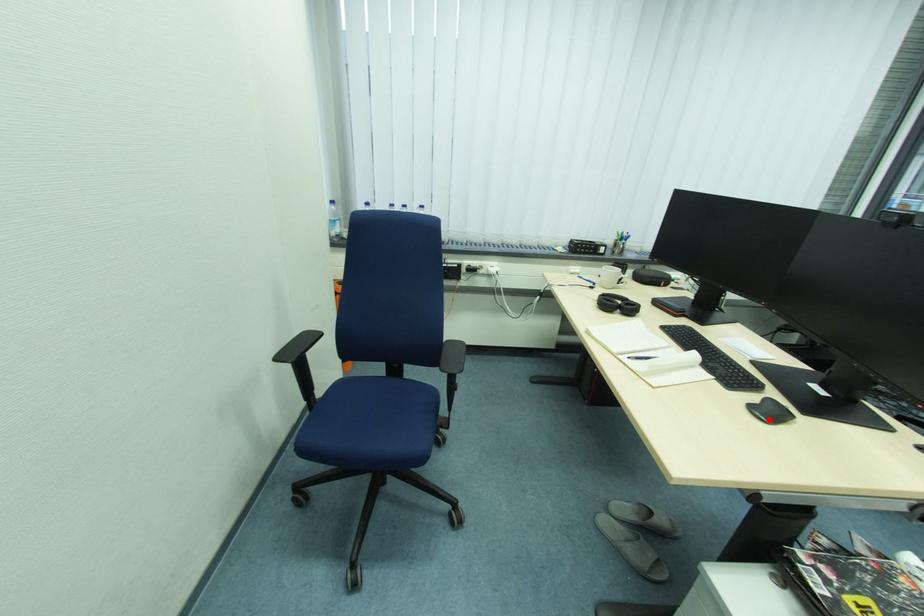
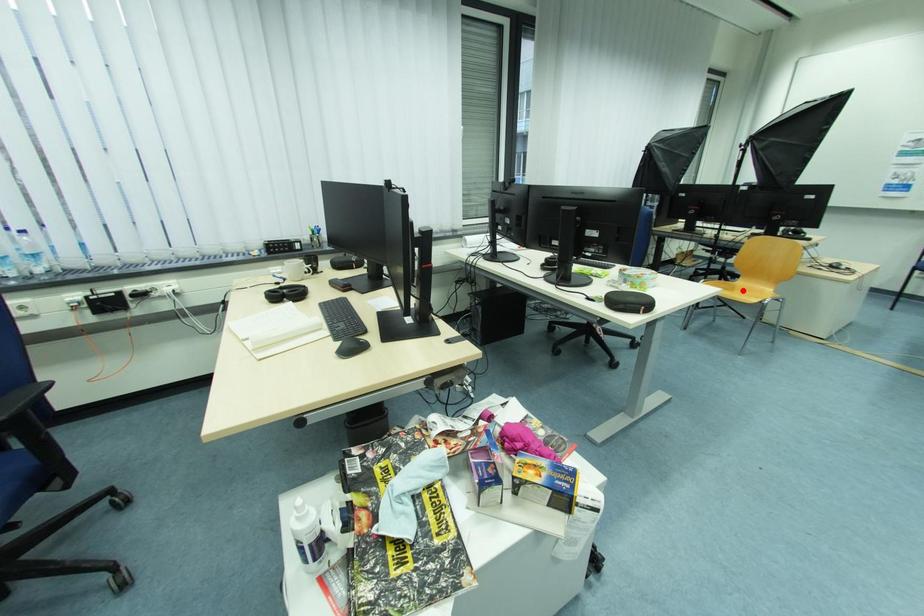
I am providing you with two images of the same scene from different viewpoints. A red point is marked on the first image and another point is marked on the second image. Does the point marked in image1 correspond to the same location as the one in image2?

No